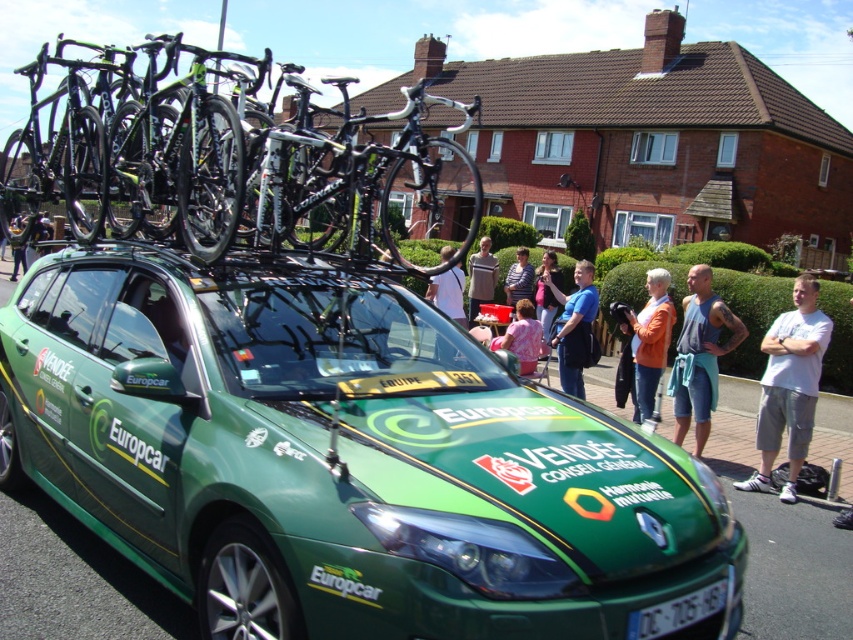
Who is higher up, white cotton t-shirt at right or blue fabric shirt at center?

blue fabric shirt at center is above.

Can you confirm if white cotton t-shirt at right is positioned to the left of blue fabric shirt at center?

In fact, white cotton t-shirt at right is to the right of blue fabric shirt at center.

Between point (825, 348) and point (579, 326), which one is positioned behind?

The point (579, 326) is more distant.

You are a GUI agent. You are given a task and a screenshot of the screen. Output one action in this format:
    pyautogui.click(x=<x>, y=<y>)
    Task: Click on the white cotton t-shirt at right
    This screenshot has width=853, height=640.
    Given the screenshot: What is the action you would take?
    pyautogui.click(x=788, y=387)

Is orange fabric jacket at center thinner than black plastic license plate at bottom center?

Yes.

Describe the element at coordinates (648, 340) in the screenshot. The height and width of the screenshot is (640, 853). I see `orange fabric jacket at center` at that location.

At what (x,y) coordinates should I click in order to perform the action: click on orange fabric jacket at center. Please return your answer as a coordinate pair (x, y). Looking at the image, I should click on (648, 340).

Can you confirm if blue fabric shorts at center is shorter than blue fabric shirt at center?

No, blue fabric shorts at center is not shorter than blue fabric shirt at center.

Consider the image. Does blue fabric shorts at center have a lesser width compared to blue fabric shirt at center?

In fact, blue fabric shorts at center might be wider than blue fabric shirt at center.

Is point (711, 385) behind point (561, 380)?

No.

I want to click on blue fabric shorts at center, so click(x=700, y=355).